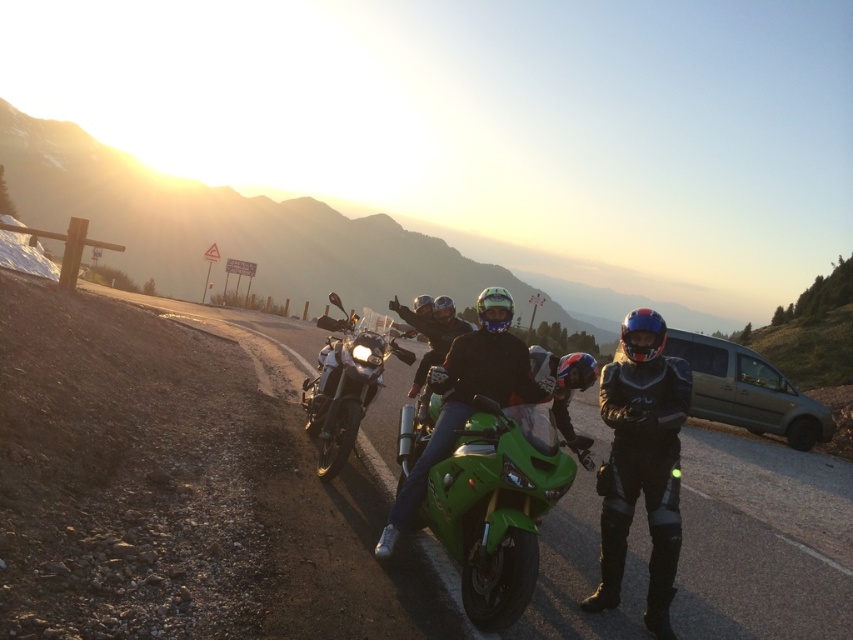
Does black leather jacket at center appear over shiny chrome motorcycle at center?

Actually, black leather jacket at center is below shiny chrome motorcycle at center.

Where is `black leather jacket at center`? This screenshot has height=640, width=853. black leather jacket at center is located at coordinates (641, 464).

Does green glossy motorcycle at center have a lesser height compared to shiny chrome motorcycle at center?

Yes.

Does green glossy motorcycle at center appear on the right side of shiny chrome motorcycle at center?

Indeed, green glossy motorcycle at center is positioned on the right side of shiny chrome motorcycle at center.

Between point (531, 401) and point (326, 321), which one is positioned in front?

Point (531, 401) is in front.

The image size is (853, 640). What are the coordinates of `green glossy motorcycle at center` in the screenshot? It's located at (466, 397).

Which of these two, green matte motorcycle at center or green glossy motorcycle at center, stands shorter?

Standing shorter between the two is green matte motorcycle at center.

Who is higher up, green matte motorcycle at center or green glossy motorcycle at center?

green glossy motorcycle at center

Describe the element at coordinates (502, 497) in the screenshot. The width and height of the screenshot is (853, 640). I see `green matte motorcycle at center` at that location.

This screenshot has height=640, width=853. What are the coordinates of `green matte motorcycle at center` in the screenshot? It's located at (502, 497).